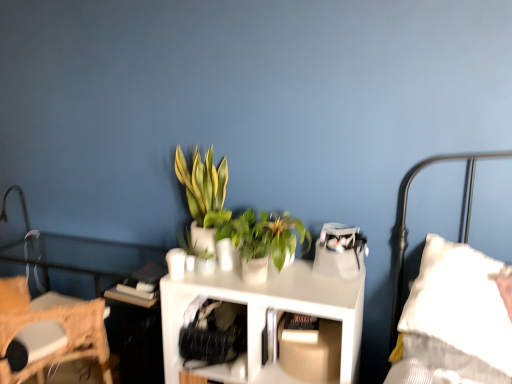
Question: Is white matte table at center at the left side of metallic silver table lamp at left?

Choices:
 (A) yes
 (B) no

Answer: (B)

Question: Is white matte table at center positioned beyond the bounds of metallic silver table lamp at left?

Choices:
 (A) no
 (B) yes

Answer: (B)

Question: Can you confirm if white matte table at center is bigger than metallic silver table lamp at left?

Choices:
 (A) yes
 (B) no

Answer: (A)

Question: Is white matte table at center surrounding metallic silver table lamp at left?

Choices:
 (A) yes
 (B) no

Answer: (B)

Question: From a real-world perspective, is white matte table at center over metallic silver table lamp at left?

Choices:
 (A) no
 (B) yes

Answer: (A)

Question: From the image's perspective, is green matte plant at center, which ranks as the second houseplant in left-to-right order, positioned above or below white matte table at center?

Choices:
 (A) below
 (B) above

Answer: (B)

Question: Would you say green matte plant at center, which is counted as the 1th houseplant, starting from the right, is inside or outside white matte table at center?

Choices:
 (A) inside
 (B) outside

Answer: (B)

Question: Looking at their shapes, would you say green matte plant at center, which is counted as the 1th houseplant, starting from the right, is wider or thinner than white matte table at center?

Choices:
 (A) thin
 (B) wide

Answer: (A)

Question: Considering their positions, is green matte plant at center, which is counted as the 1th houseplant, starting from the right, located in front of or behind white matte table at center?

Choices:
 (A) front
 (B) behind

Answer: (B)

Question: Is green leafy plant at center, arranged as the 2th houseplant when viewed from the right, in front of or behind metallic silver table lamp at left in the image?

Choices:
 (A) behind
 (B) front

Answer: (B)

Question: From the image's perspective, relative to metallic silver table lamp at left, is green leafy plant at center, arranged as the 2th houseplant when viewed from the right, above or below?

Choices:
 (A) above
 (B) below

Answer: (A)

Question: In the image, is green leafy plant at center, which appears as the first houseplant when viewed from the left, on the left side or the right side of metallic silver table lamp at left?

Choices:
 (A) left
 (B) right

Answer: (B)

Question: From a real-world perspective, relative to metallic silver table lamp at left, is green leafy plant at center, arranged as the 2th houseplant when viewed from the right, vertically above or below?

Choices:
 (A) below
 (B) above

Answer: (B)

Question: Looking at their shapes, would you say green matte plant at center, which ranks as the second houseplant in left-to-right order, is wider or thinner than green leafy plant at center, arranged as the 2th houseplant when viewed from the right?

Choices:
 (A) thin
 (B) wide

Answer: (A)

Question: From the image's perspective, is green matte plant at center, which is counted as the 1th houseplant, starting from the right, positioned above or below green leafy plant at center, which appears as the first houseplant when viewed from the left?

Choices:
 (A) above
 (B) below

Answer: (B)